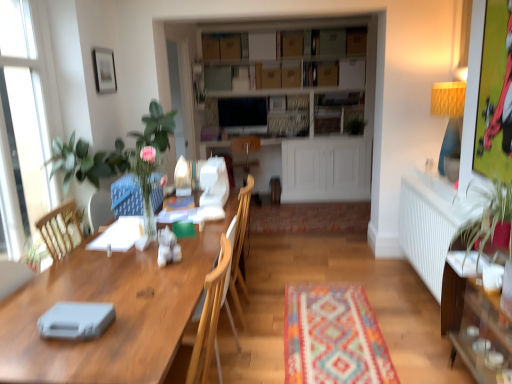
Where is `vacant point above multicolored woven mat at center (from a real-world perspective)`? This screenshot has height=384, width=512. vacant point above multicolored woven mat at center (from a real-world perspective) is located at coordinates (330, 317).